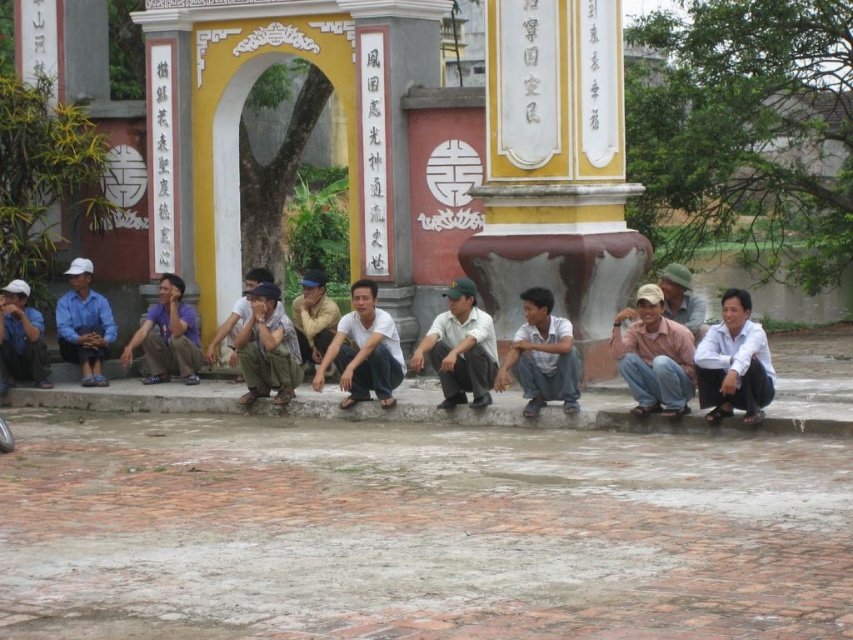
Is point (456, 330) closer to camera compared to point (354, 296)?

Yes, it is in front of point (354, 296).

Is the position of white matte uniform at center more distant than that of white cotton shirt at center?

Yes, it is.

From the picture: Who is more distant from viewer, (480, 349) or (364, 285)?

Positioned behind is point (364, 285).

Identify the location of white matte uniform at center. Image resolution: width=853 pixels, height=640 pixels. (460, 348).

Can you confirm if white matte uniform at center is bigger than light brown cap at center?

Incorrect, white matte uniform at center is not larger than light brown cap at center.

Does white matte uniform at center have a smaller size compared to light brown cap at center?

Yes, white matte uniform at center is smaller than light brown cap at center.

Locate an element on the screen. white matte uniform at center is located at coordinates (460, 348).

Where is `white matte uniform at center`? Image resolution: width=853 pixels, height=640 pixels. white matte uniform at center is located at coordinates (460, 348).

Measure the distance from white matte shirt at lower right to khaki pants at center.

white matte shirt at lower right is 13.98 meters away from khaki pants at center.

Measure the distance between point [743,376] and camera.

Point [743,376] is 41.12 meters from camera.

Is point (698, 358) in front of point (286, 330)?

Yes, it is.

Where is `white matte shirt at lower right`? white matte shirt at lower right is located at coordinates (734, 362).